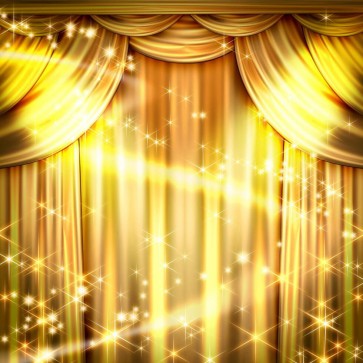
The image size is (363, 363). Find the location of `right curtain`. right curtain is located at coordinates (338, 295).